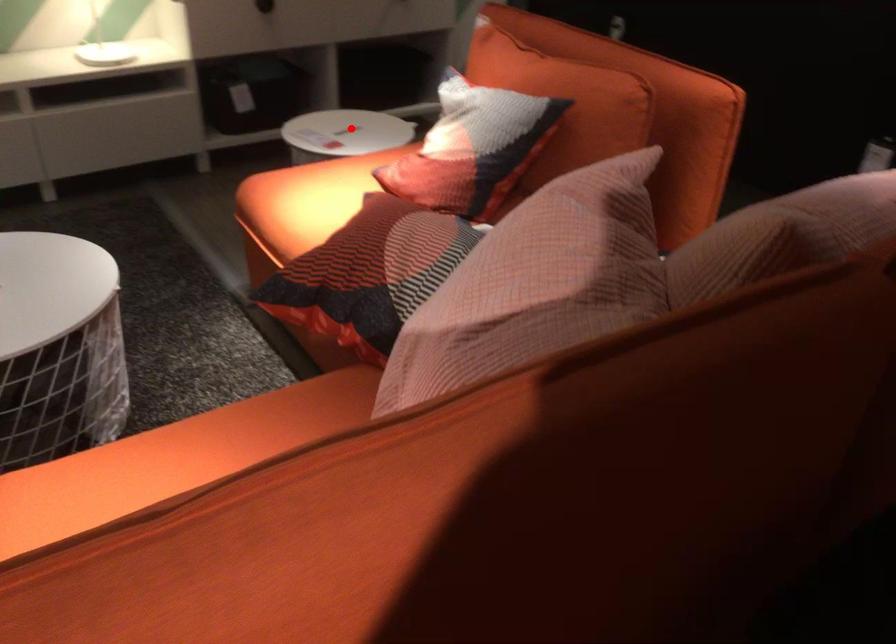
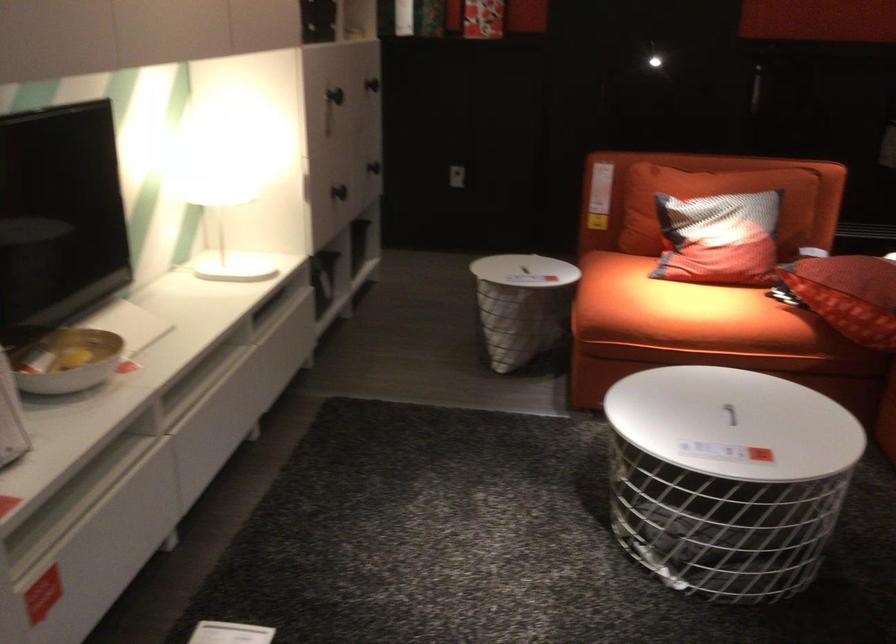
Question: I am providing you with two images of the same scene from different viewpoints. Image1 has a red point marked. In image2, the corresponding 3D location appears at what relative position? Reply with the corresponding letter.

Choices:
 (A) Closer
 (B) Farther

Answer: (B)